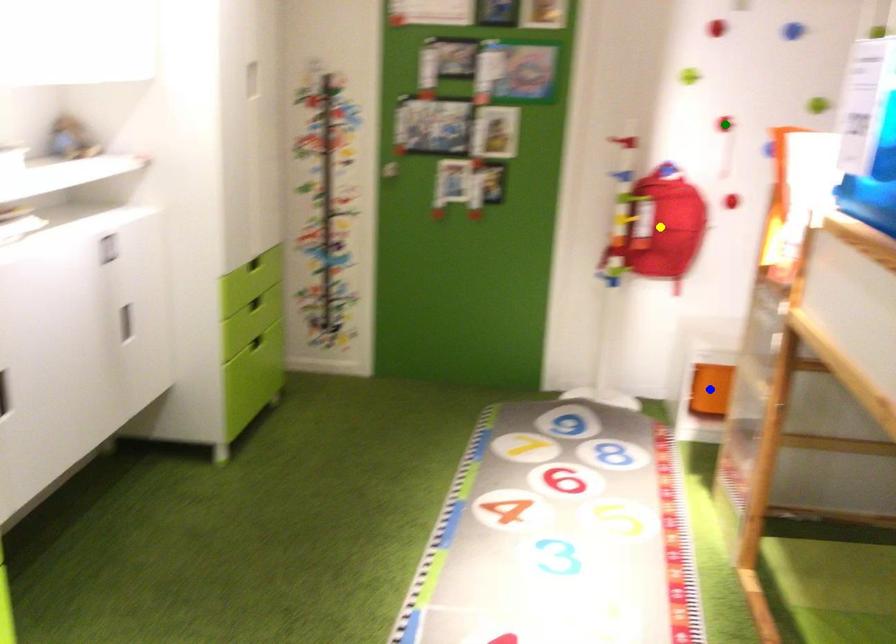
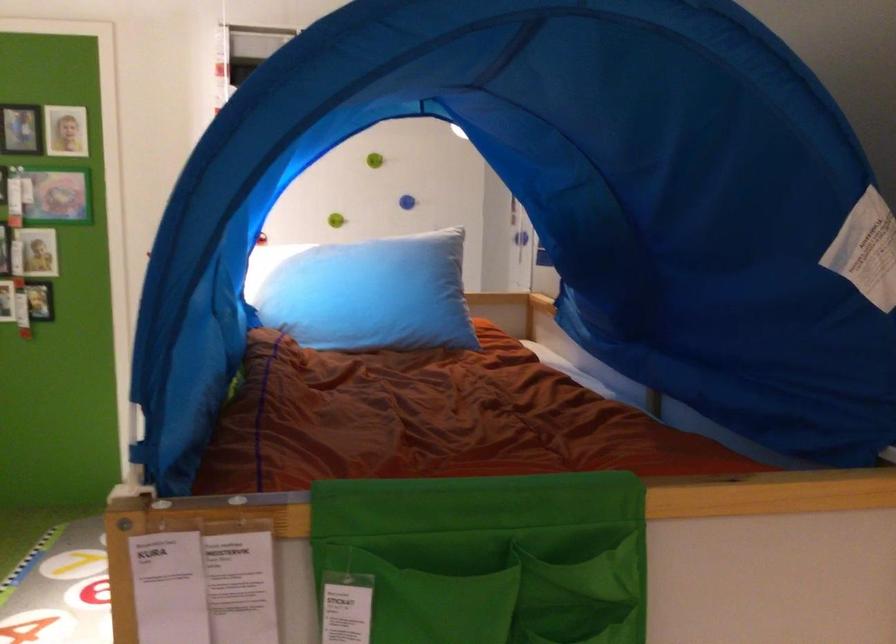
I am providing you with two images of the same scene from different viewpoints. Three points are marked in image1. Which point corresponds to a part or object that is occluded in image2?In image1, three points are marked. Which of them correspond to a part or object that is occluded in image2?Among the three points shown in image1, which one corresponds to a part or object that is no longer visible due to occlusion in image2?

yellow point, green point, blue point